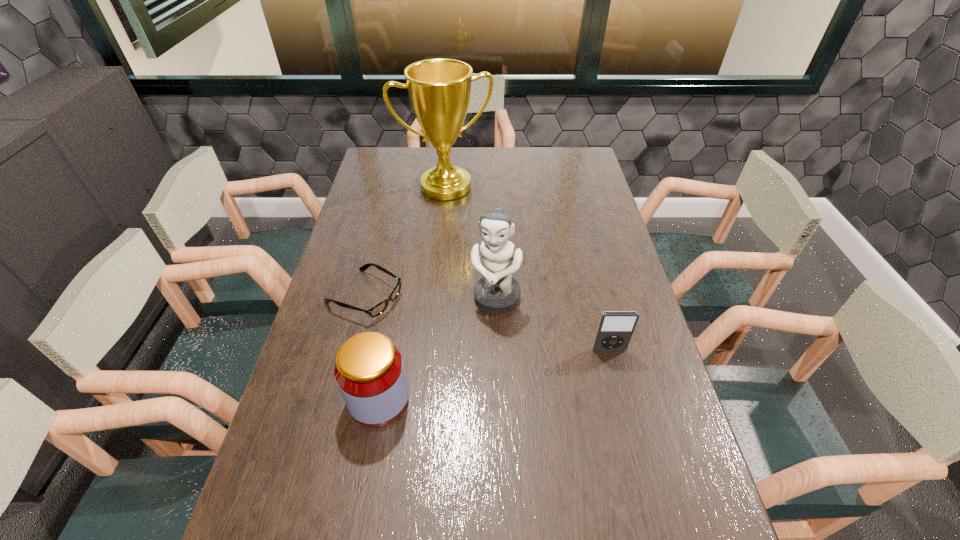
Where is `unoccupied area between the nearest object and the tallest object`? The image size is (960, 540). unoccupied area between the nearest object and the tallest object is located at coordinates (412, 293).

The width and height of the screenshot is (960, 540). Identify the location of free space between the tallest object and the rightmost object. (527, 268).

Locate an element on the screen. The height and width of the screenshot is (540, 960). free space between the farthest object and the spectacles is located at coordinates (405, 241).

The width and height of the screenshot is (960, 540). Find the location of `vacant region between the third tallest object and the fourth farthest object`. vacant region between the third tallest object and the fourth farthest object is located at coordinates (493, 375).

This screenshot has height=540, width=960. In order to click on free space that is in between the fourth tallest object and the third tallest object in this screenshot , I will do `click(493, 375)`.

The width and height of the screenshot is (960, 540). Identify the location of vacant space in between the award and the shortest object. (405, 241).

This screenshot has width=960, height=540. I want to click on free spot between the farthest object and the spectacles, so click(405, 241).

Image resolution: width=960 pixels, height=540 pixels. I want to click on free spot between the shortest object and the tallest object, so click(x=405, y=241).

You are a GUI agent. You are given a task and a screenshot of the screen. Output one action in this format:
    pyautogui.click(x=<x>, y=<y>)
    Task: Click on the free space between the tallest object and the figurine
    The image size is (960, 540).
    Given the screenshot: What is the action you would take?
    pyautogui.click(x=471, y=243)

Locate an element on the screen. The width and height of the screenshot is (960, 540). the second closest object to the rightmost object is located at coordinates (369, 371).